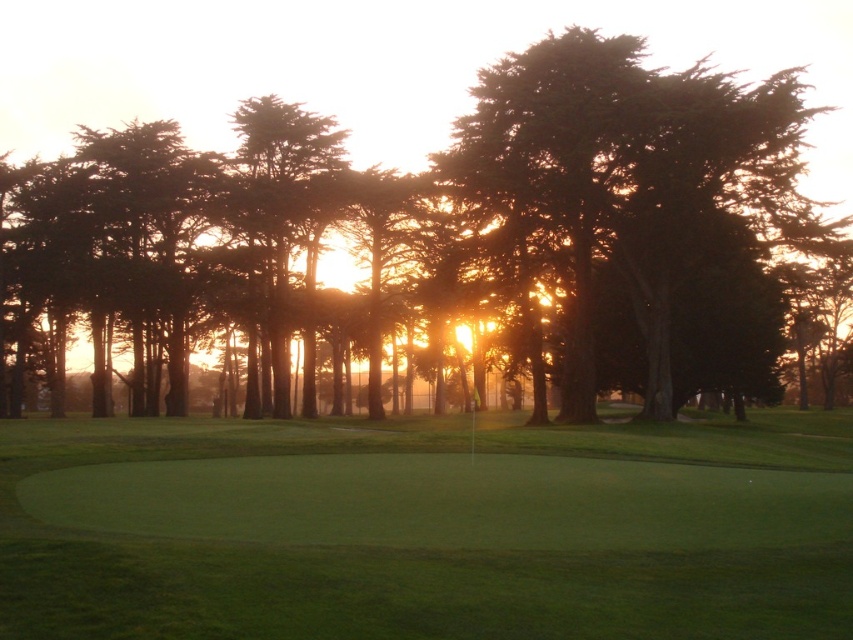
Question: Does green smooth grass at center appear on the right side of green leafy tree at center?

Choices:
 (A) yes
 (B) no

Answer: (B)

Question: Does green smooth grass at center have a larger size compared to green leafy tree at center?

Choices:
 (A) no
 (B) yes

Answer: (A)

Question: Observing the image, what is the correct spatial positioning of green smooth grass at center in reference to green leafy tree at center?

Choices:
 (A) right
 (B) left

Answer: (B)